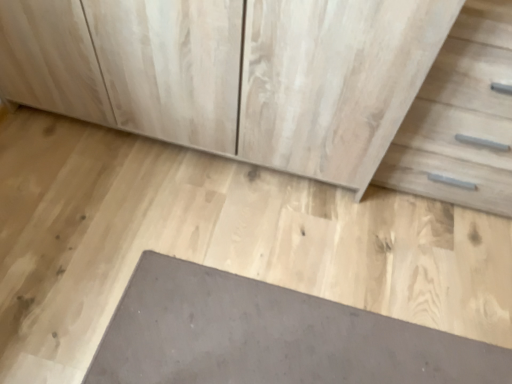
Find the location of a particular element. The image size is (512, 384). empty space that is ontop of gray concrete at center (from a real-world perspective) is located at coordinates (217, 254).